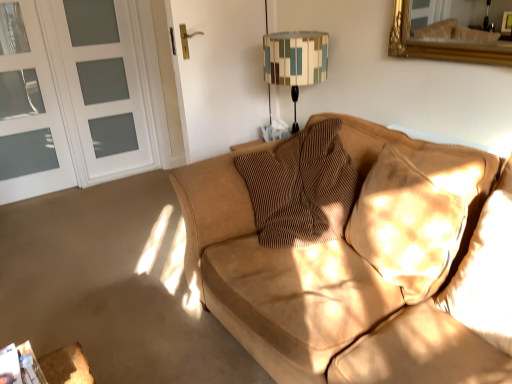
Question: From the image's perspective, is suede pillow at right, which is the second pillow from left to right, located above brown textured pillow at center, which is the 3th pillow from right to left?

Choices:
 (A) no
 (B) yes

Answer: (A)

Question: Can you confirm if suede pillow at right, positioned as the second pillow in right-to-left order, is wider than brown textured pillow at center, positioned as the 1th pillow in left-to-right order?

Choices:
 (A) yes
 (B) no

Answer: (B)

Question: From a real-world perspective, is suede pillow at right, which is the second pillow from left to right, on brown textured pillow at center, which is the 3th pillow from right to left?

Choices:
 (A) no
 (B) yes

Answer: (B)

Question: Is the position of suede pillow at right, positioned as the second pillow in right-to-left order, less distant than that of brown textured pillow at center, which is the 3th pillow from right to left?

Choices:
 (A) no
 (B) yes

Answer: (B)

Question: Are suede pillow at right, positioned as the second pillow in right-to-left order, and brown textured pillow at center, positioned as the 1th pillow in left-to-right order, located far from each other?

Choices:
 (A) yes
 (B) no

Answer: (B)

Question: Is suede pillow at right, positioned as the second pillow in right-to-left order, facing towards brown textured pillow at center, which is the 3th pillow from right to left?

Choices:
 (A) no
 (B) yes

Answer: (A)

Question: From the image's perspective, is geometric fabric lampshade at upper center on white glass screen door at left, the 2th screen door from the right?

Choices:
 (A) yes
 (B) no

Answer: (B)

Question: Is geometric fabric lampshade at upper center wider than white glass screen door at left, the 2th screen door from the right?

Choices:
 (A) no
 (B) yes

Answer: (B)

Question: Are geometric fabric lampshade at upper center and white glass screen door at left, the 2th screen door from the right, making contact?

Choices:
 (A) no
 (B) yes

Answer: (A)

Question: Is white glass screen door at left, placed as the 1th screen door when sorted from left to right, at the back of geometric fabric lampshade at upper center?

Choices:
 (A) no
 (B) yes

Answer: (A)

Question: Is geometric fabric lampshade at upper center at the right side of white glass screen door at left, the 2th screen door from the right?

Choices:
 (A) yes
 (B) no

Answer: (A)

Question: Is geometric fabric lampshade at upper center positioned before white glass screen door at left, placed as the 1th screen door when sorted from left to right?

Choices:
 (A) no
 (B) yes

Answer: (B)

Question: From the image's perspective, does white frosted glass screen door at left, which ranks as the first screen door in right-to-left order, appear lower than brown textured pillow at center, positioned as the 1th pillow in left-to-right order?

Choices:
 (A) no
 (B) yes

Answer: (A)